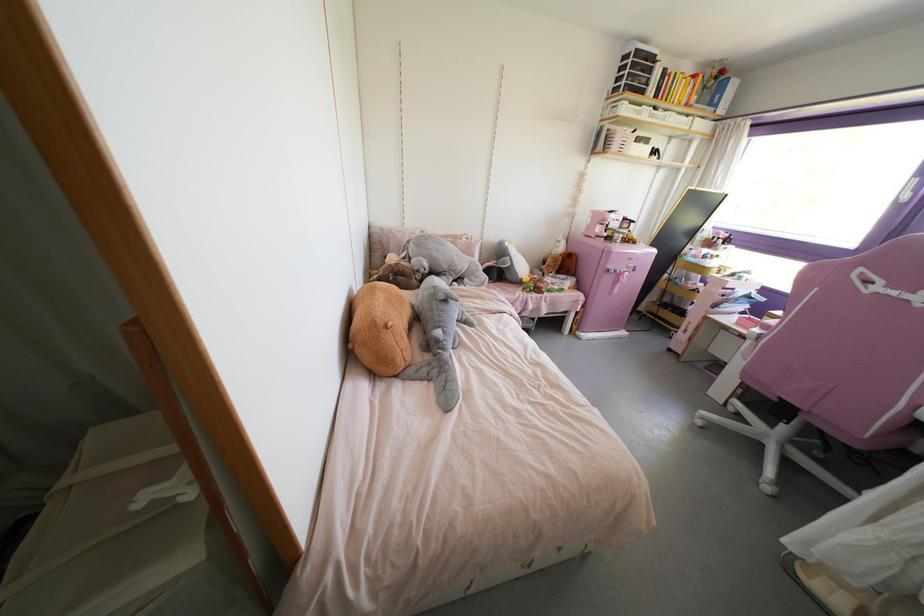
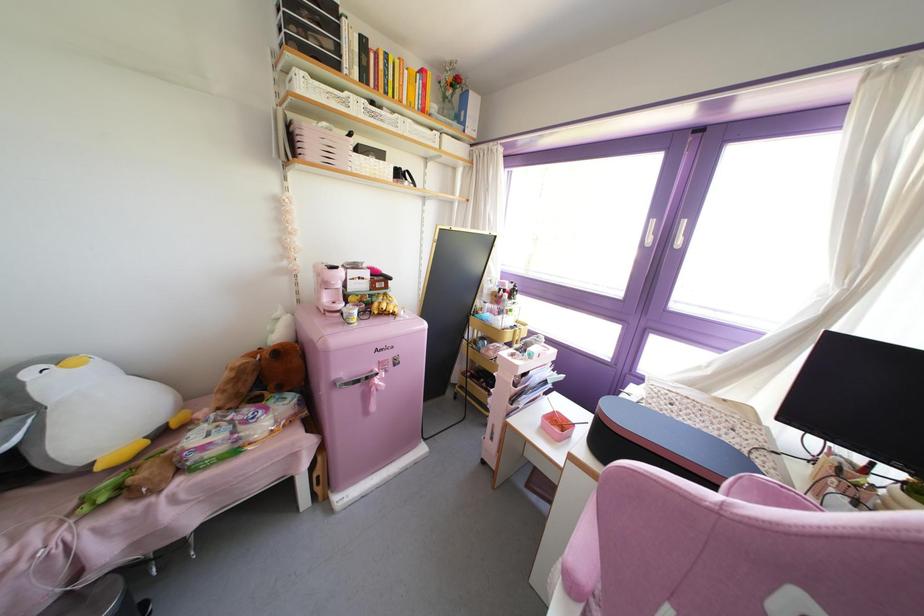
Locate, in the second image, the point that corresponds to (523,280) in the first image.

(99, 467)